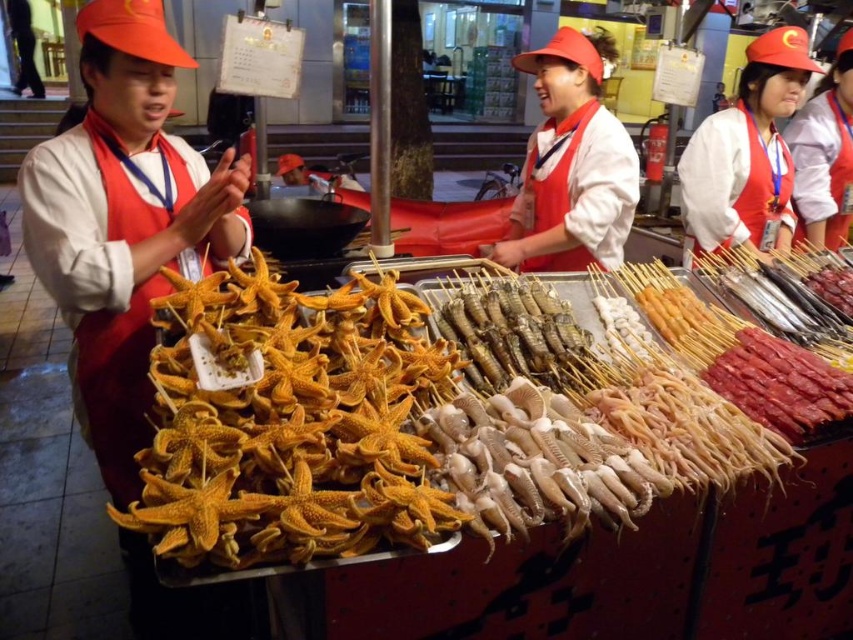
Describe the element at coordinates (125, 221) in the screenshot. I see `orange fabric apron at left` at that location.

Between point (48, 273) and point (776, 166), which one is positioned in front?

Point (48, 273)

Is point (129, 241) behind point (740, 161)?

No, it is in front of (740, 161).

What are the coordinates of `orange fabric apron at left` in the screenshot? It's located at (125, 221).

Between golden starfish at center and orange fabric apron at left, which one appears on the left side from the viewer's perspective?

orange fabric apron at left is more to the left.

Is point (810, 428) closer to viewer compared to point (122, 499)?

Yes.

This screenshot has width=853, height=640. What do you see at coordinates (450, 413) in the screenshot?
I see `golden starfish at center` at bounding box center [450, 413].

Where is `golden starfish at center`? The width and height of the screenshot is (853, 640). golden starfish at center is located at coordinates (450, 413).

Measure the distance from golden starfish at center to matte red apron at center.

They are 37.57 inches apart.

In the scene shown: Which of these two, golden starfish at center or matte red apron at center, stands taller?

Standing taller between the two is matte red apron at center.

At what (x,y) coordinates should I click in order to perform the action: click on golden starfish at center. Please return your answer as a coordinate pair (x, y). Image resolution: width=853 pixels, height=640 pixels. Looking at the image, I should click on (450, 413).